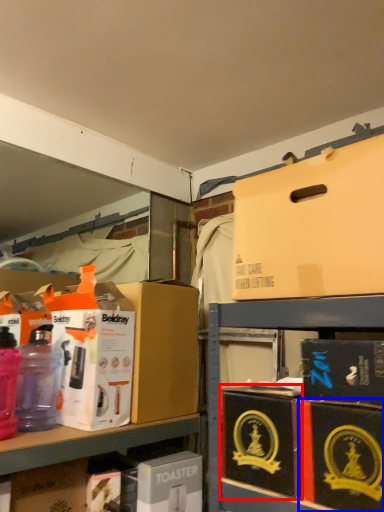
Question: Among these objects, which one is farthest to the camera, box (highlighted by a red box) or box (highlighted by a blue box)?

Choices:
 (A) box
 (B) box

Answer: (A)